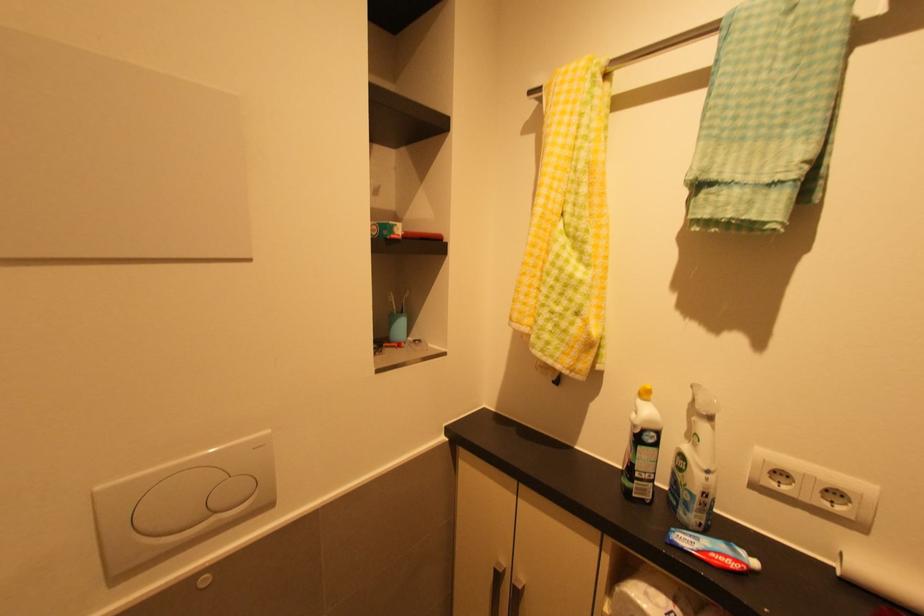
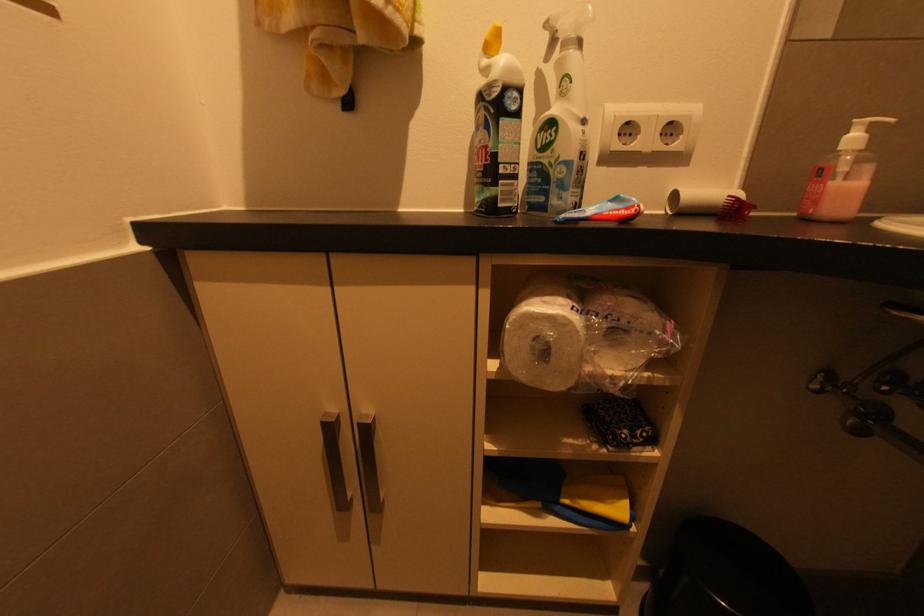
The first image is from the beginning of the video and the second image is from the end. How did the camera likely rotate when shooting the video?

The camera rotated toward right-down.